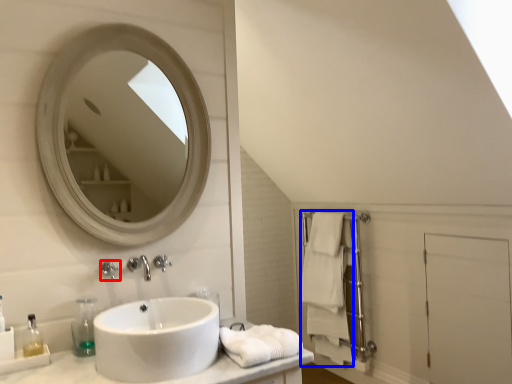
Question: Which of the following is the farthest to the observer, faucet (highlighted by a red box) or bath towel (highlighted by a blue box)?

Choices:
 (A) faucet
 (B) bath towel

Answer: (B)